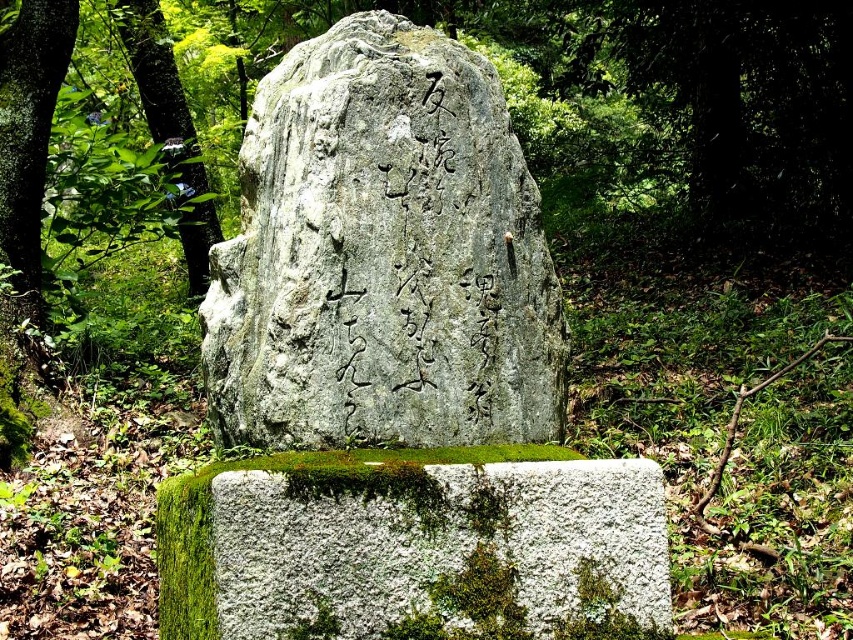
Question: Among these objects, which one is farthest from the camera?

Choices:
 (A) green leafy tree at left
 (B) gray stone boulder at center

Answer: (A)

Question: Which point is closer to the camera?

Choices:
 (A) gray stone boulder at center
 (B) green leafy tree at left
 (C) green mossy stone at center

Answer: (C)

Question: Which object appears closest to the camera in this image?

Choices:
 (A) green leafy tree at left
 (B) green mossy stone at center
 (C) gray stone boulder at center

Answer: (B)

Question: Can you confirm if green mossy stone at center is positioned above green leafy tree at left?

Choices:
 (A) yes
 (B) no

Answer: (B)

Question: Is gray stone boulder at center positioned at the back of green mossy stone at center?

Choices:
 (A) yes
 (B) no

Answer: (A)

Question: Does gray stone boulder at center have a greater width compared to green leafy tree at left?

Choices:
 (A) no
 (B) yes

Answer: (B)